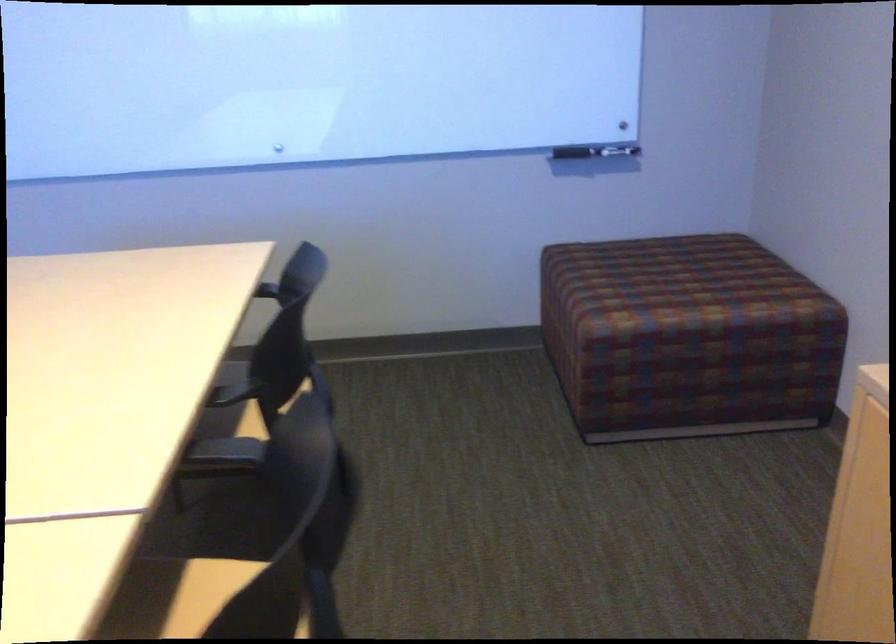
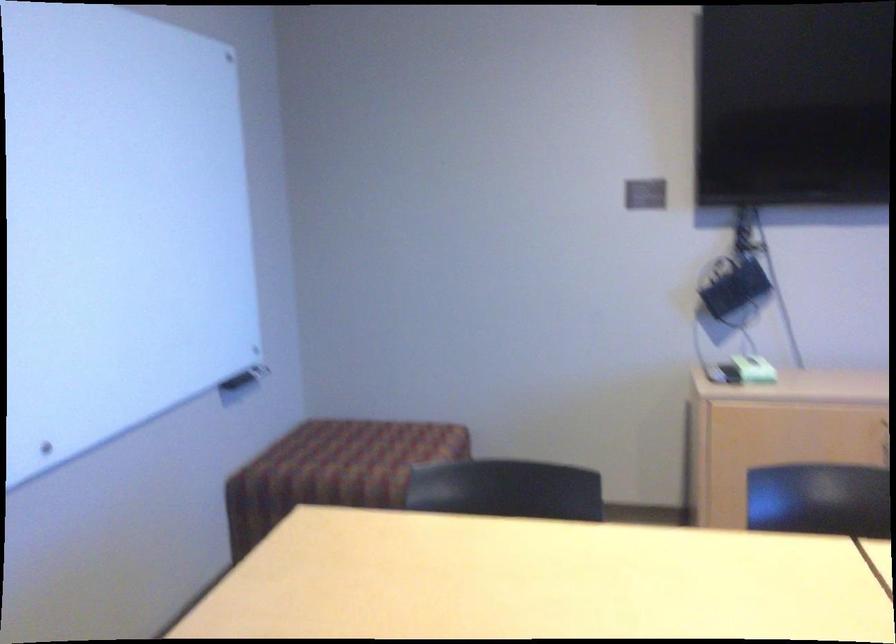
The point at (613, 272) is marked in the first image. Where is the corresponding point in the second image?

(331, 465)